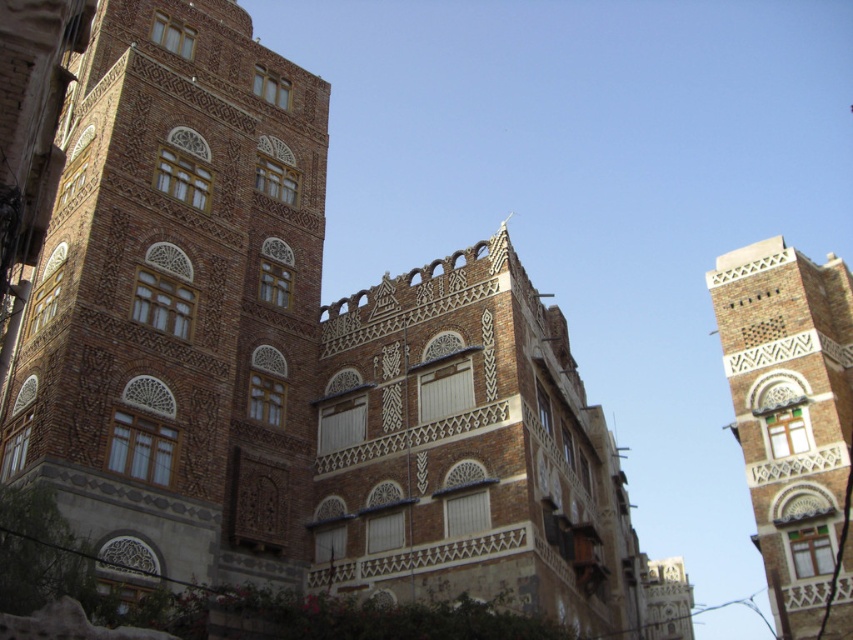
Question: Is brown textured building at center thinner than brown textured tower at upper right?

Choices:
 (A) yes
 (B) no

Answer: (A)

Question: Which of the following is the closest to the observer?

Choices:
 (A) brown textured tower at upper right
 (B) brown textured building at center

Answer: (B)

Question: Is brown textured building at center thinner than brown textured tower at upper right?

Choices:
 (A) yes
 (B) no

Answer: (A)

Question: Which point is closer to the camera taking this photo?

Choices:
 (A) (799, 412)
 (B) (125, 256)

Answer: (B)

Question: Which point appears closest to the camera in this image?

Choices:
 (A) (276, 403)
 (B) (747, 392)

Answer: (A)

Question: Does brown textured building at center appear on the right side of brown textured tower at upper right?

Choices:
 (A) yes
 (B) no

Answer: (B)